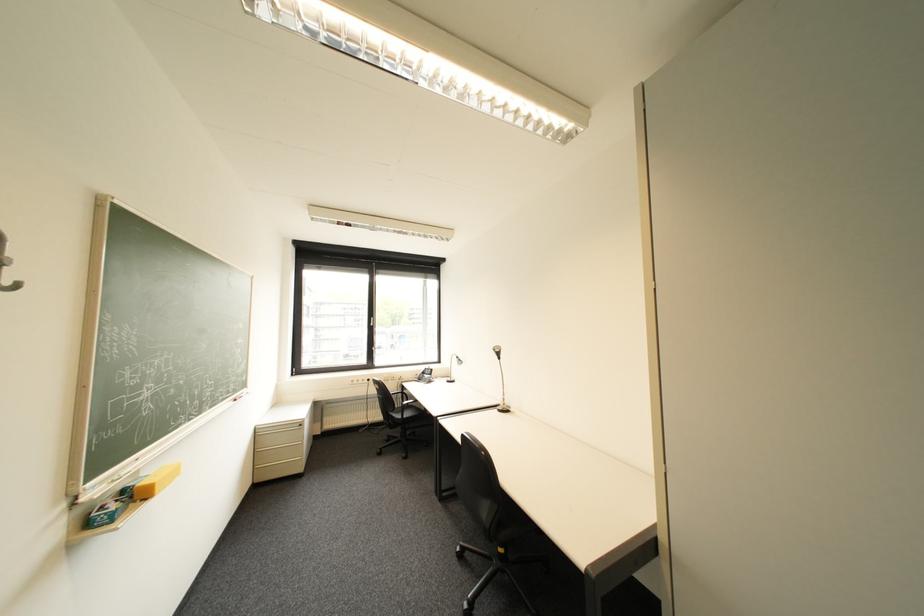
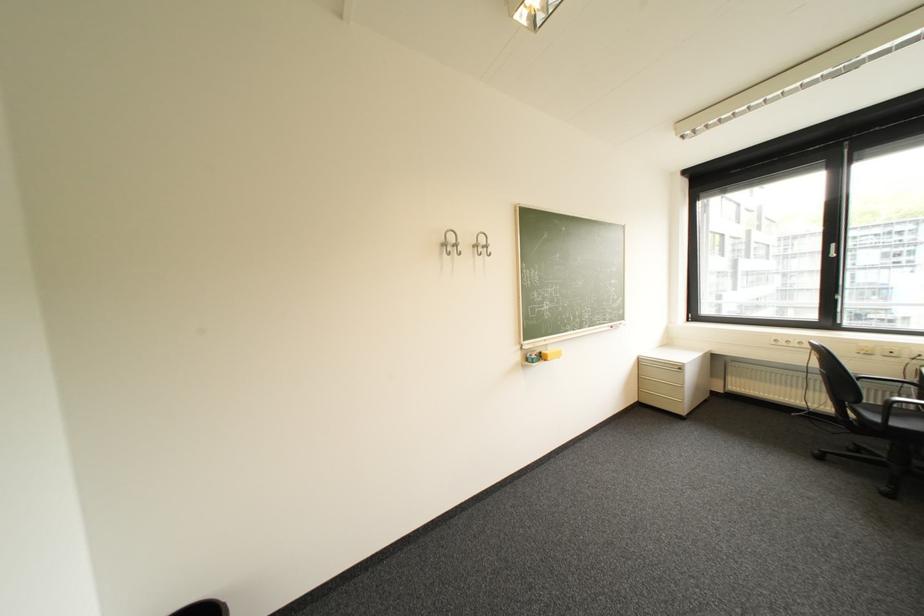
Question: The images are taken continuously from a first-person perspective. In which direction is your viewpoint rotating?

Choices:
 (A) Left
 (B) Right
 (C) Up
 (D) Down

Answer: (A)